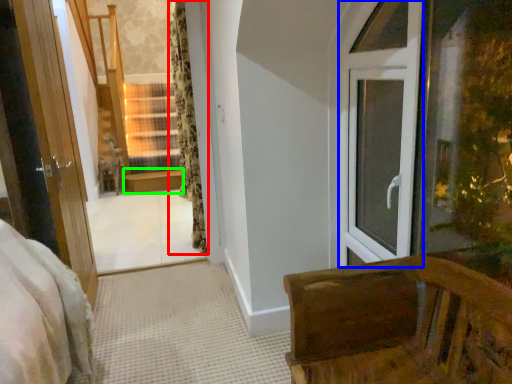
Question: Estimate the real-world distances between objects in this image. Which object is farther from curtain (highlighted by a red box), window frame (highlighted by a blue box) or window sill (highlighted by a green box)?

Choices:
 (A) window frame
 (B) window sill

Answer: (A)